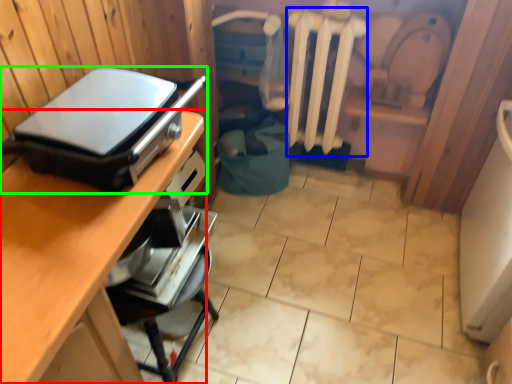
Question: Which object is the farthest from desk (highlighted by a red box)? Choose among these: radiator (highlighted by a blue box) or appliance (highlighted by a green box).

Choices:
 (A) radiator
 (B) appliance

Answer: (A)